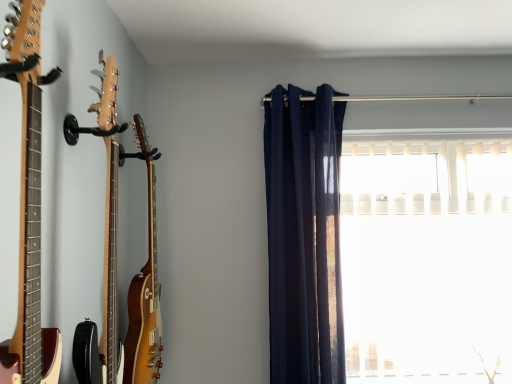
Question: From a real-world perspective, is light brown wood guitar at left, which ranks as the second guitar in back-to-front order, above or below glossy wood guitar at left, positioned as the third guitar in front-to-back order?

Choices:
 (A) below
 (B) above

Answer: (B)

Question: From the image's perspective, is light brown wood guitar at left, which ranks as the second guitar in back-to-front order, positioned above or below glossy wood guitar at left, positioned as the third guitar in front-to-back order?

Choices:
 (A) below
 (B) above

Answer: (B)

Question: Based on their relative distances, which object is farther from the white plastic blinds at right?

Choices:
 (A) glossy wood guitar at left, which is counted as the 1th guitar, starting from the back
 (B) wooden acoustic guitar at left, positioned as the third guitar in back-to-front order
 (C) navy blue fabric curtain at center
 (D) light brown wood guitar at left, which ranks as the second guitar in back-to-front order

Answer: (B)

Question: Estimate the real-world distances between objects in this image. Which object is closer to the light brown wood guitar at left, which ranks as the second guitar in back-to-front order?

Choices:
 (A) white plastic blinds at right
 (B) navy blue fabric curtain at center
 (C) wooden acoustic guitar at left, which appears as the 1th guitar when viewed from the front
 (D) glossy wood guitar at left, positioned as the third guitar in front-to-back order

Answer: (C)